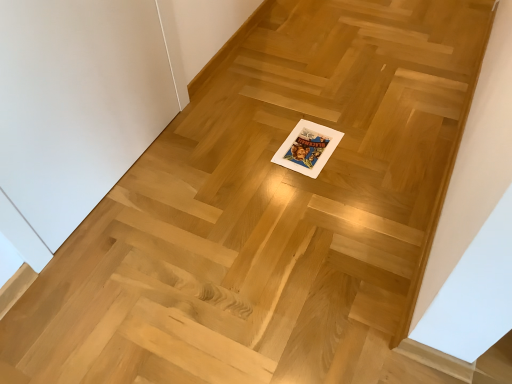
You are a GUI agent. You are given a task and a screenshot of the screen. Output one action in this format:
    pyautogui.click(x=<x>, y=<y>)
    Task: Click on the free region under white paper at center (from a real-world perspective)
    Image resolution: width=512 pixels, height=384 pixels.
    Given the screenshot: What is the action you would take?
    pyautogui.click(x=310, y=148)